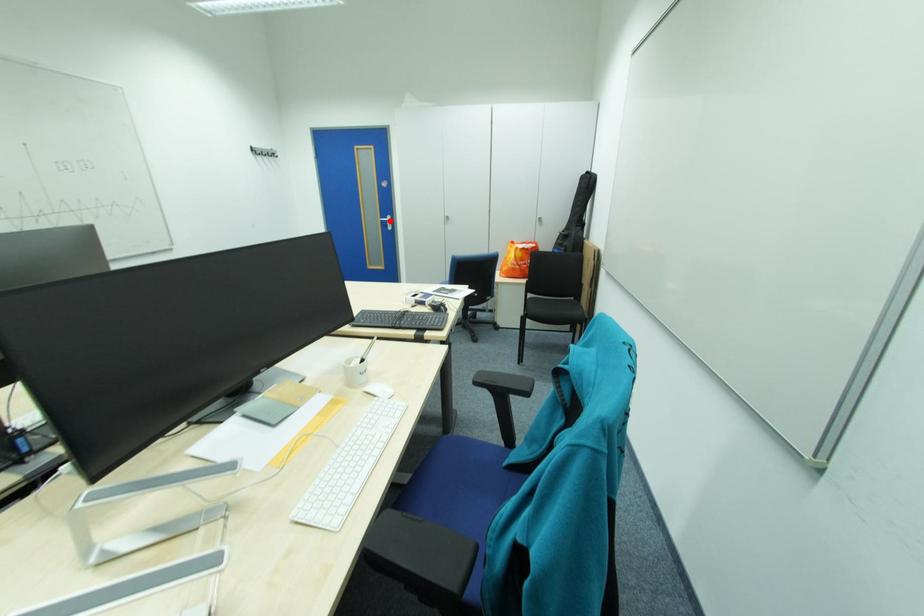
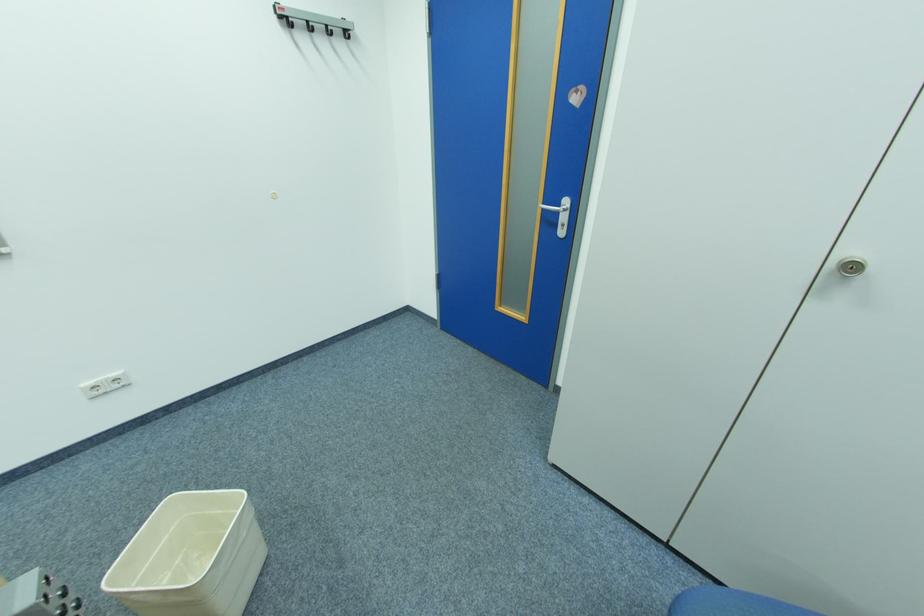
Question: I am providing you with two images of the same scene from different viewpoints. A red point is shown in image1. For the corresponding object point in image2, is it positioned nearer or farther from the camera?

Choices:
 (A) Nearer
 (B) Farther

Answer: (B)